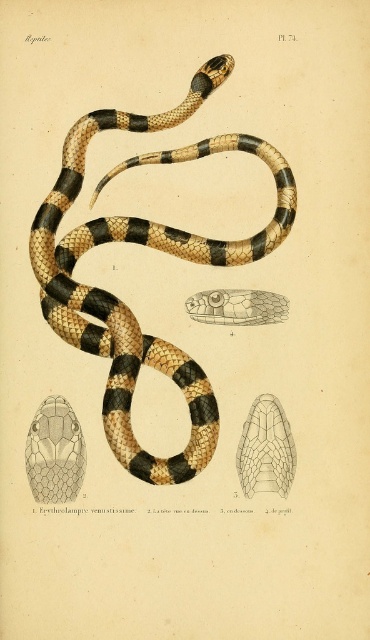
Question: In this image, where is brown and tan scales at center located relative to translucent yellow scales at center?

Choices:
 (A) below
 (B) above

Answer: (B)

Question: Which point is farther to the camera?

Choices:
 (A) (276, 451)
 (B) (76, 157)
 (C) (65, 468)

Answer: (B)

Question: Which object is closer to the camera taking this photo?

Choices:
 (A) translucent yellow scales at center
 (B) matte black snake head at upper center
 (C) brown and tan scales at center

Answer: (A)

Question: Which object is positioned farthest from the translucent yellow scales at center?

Choices:
 (A) brown and tan scales at center
 (B) matte black snake head at upper center

Answer: (B)

Question: Where is brown and tan scales at center located in relation to matte black snake head at upper center in the image?

Choices:
 (A) right
 (B) left

Answer: (A)

Question: Does brown and tan scales at center appear on the left side of translucent yellow scales at center?

Choices:
 (A) yes
 (B) no

Answer: (A)